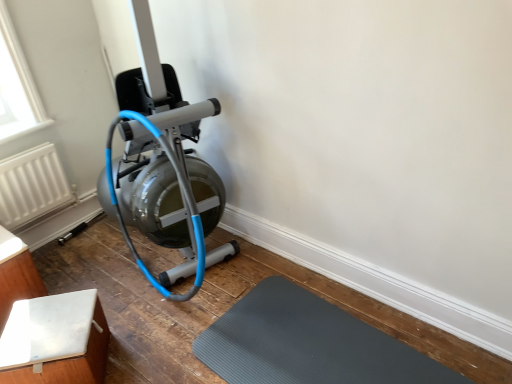
Question: Looking at their shapes, would you say white textured radiator at left is wider or thinner than matte silver stationary bicycle at left?

Choices:
 (A) thin
 (B) wide

Answer: (A)

Question: Looking at the image, does white textured radiator at left seem bigger or smaller compared to matte silver stationary bicycle at left?

Choices:
 (A) small
 (B) big

Answer: (A)

Question: Which of these objects is positioned closest to the white textured radiator at left?

Choices:
 (A) white matte table at lower left, the 2th furniture viewed from the left
 (B) gray rubber mat at lower center
 (C) white matte table at lower left, positioned as the first furniture in left-to-right order
 (D) matte silver stationary bicycle at left

Answer: (C)

Question: Which object is positioned closest to the white matte table at lower left, the 1th furniture when ordered from right to left?

Choices:
 (A) white textured radiator at left
 (B) gray rubber mat at lower center
 (C) white matte table at lower left, positioned as the first furniture in left-to-right order
 (D) matte silver stationary bicycle at left

Answer: (C)